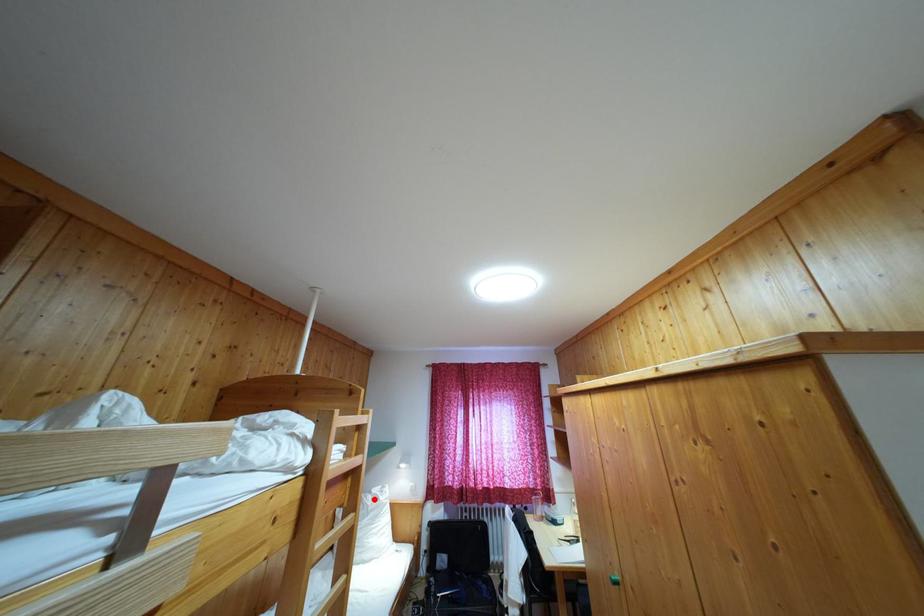
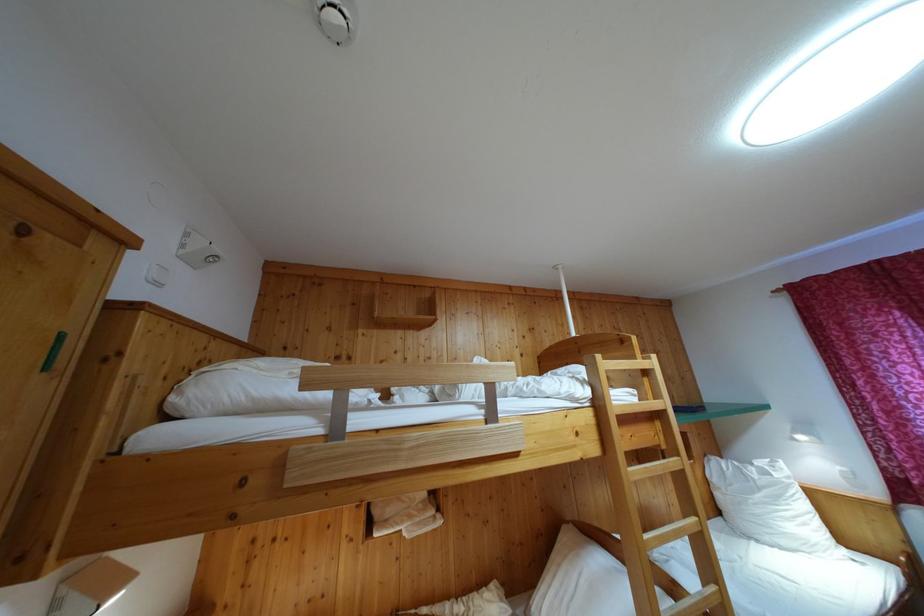
Where in the second image is the point corresponding to the highlighted location from the first image?

(755, 471)